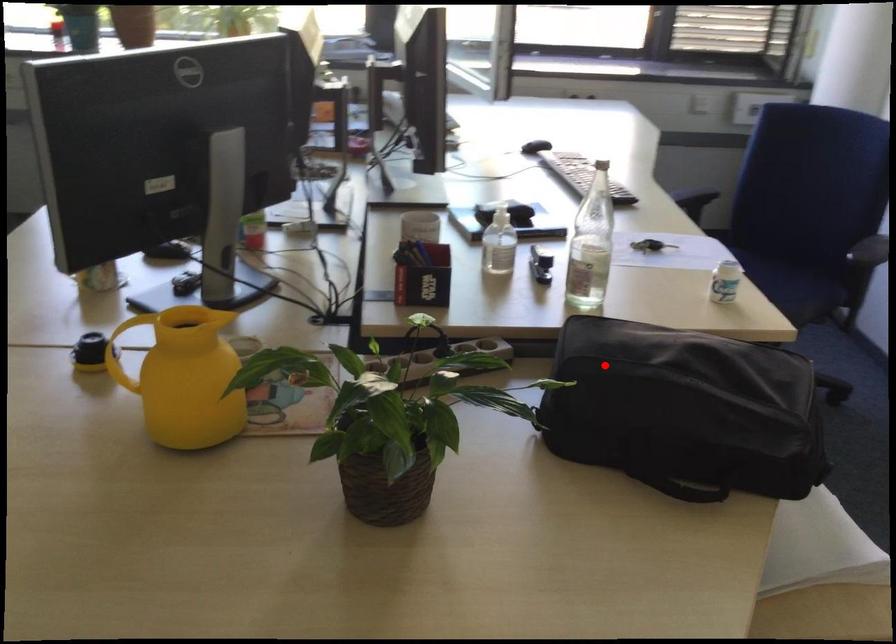
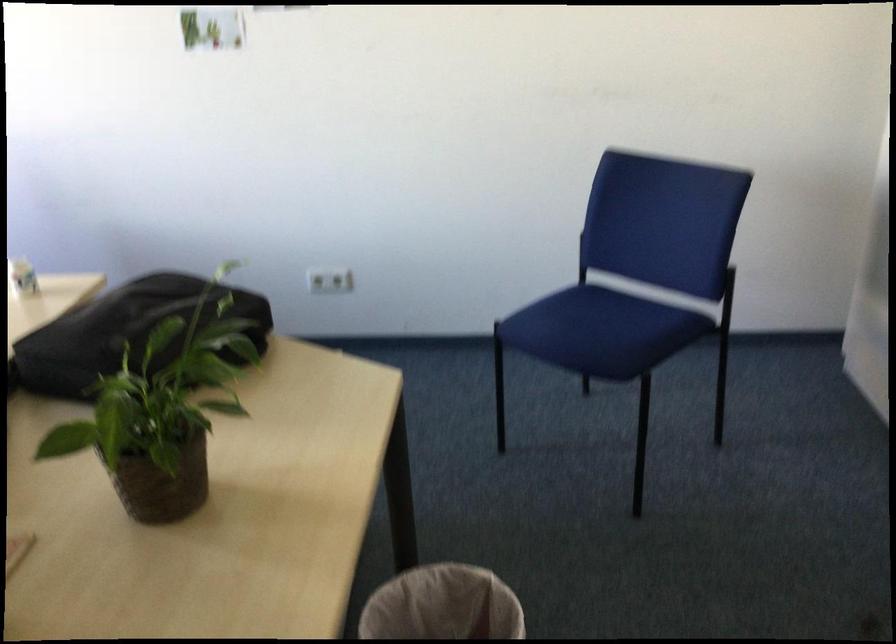
Question: I am providing you with two images of the same scene from different viewpoints. In image1, a red point is highlighted. Considering the same 3D point in image2, which of the following is correct?

Choices:
 (A) It is closer
 (B) It is farther

Answer: (B)